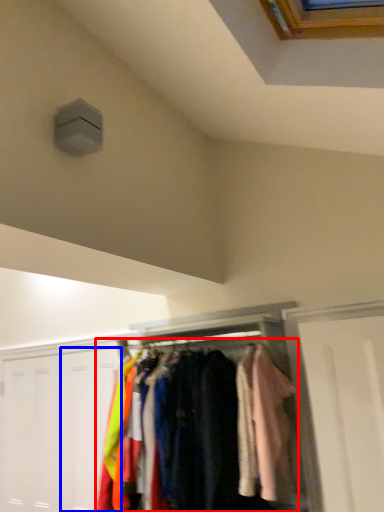
Question: Which object is closer to the camera taking this photo, garment (highlighted by a red box) or door (highlighted by a blue box)?

Choices:
 (A) garment
 (B) door

Answer: (A)